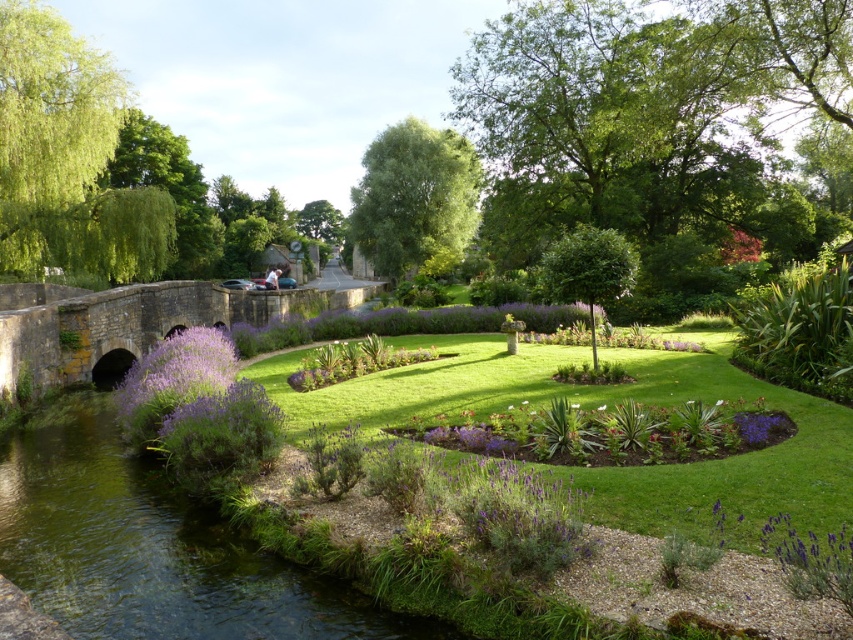
In the scene shown: Who is positioned more to the left, stone bridge at left or purple matte flower at lower right?

From the viewer's perspective, stone bridge at left appears more on the left side.

Can you confirm if stone bridge at left is positioned to the left of purple matte flower at lower right?

Yes, stone bridge at left is to the left of purple matte flower at lower right.

Is point (165, 333) in front of point (764, 440)?

No.

You are a GUI agent. You are given a task and a screenshot of the screen. Output one action in this format:
    pyautogui.click(x=<x>, y=<y>)
    Task: Click on the stone bridge at left
    This screenshot has width=853, height=640.
    Given the screenshot: What is the action you would take?
    pyautogui.click(x=136, y=323)

Is green grassy stream at lower left thinner than purple fluffy bush at left?

Incorrect, green grassy stream at lower left's width is not less than purple fluffy bush at left's.

Does point (77, 390) come behind point (218, 349)?

Yes, it is behind point (218, 349).

Where is `green grassy stream at lower left`? green grassy stream at lower left is located at coordinates (152, 547).

Is purple fluffy bush at left further to camera compared to purple matte flower at lower right?

Yes, it is.

Which of these two, purple fluffy bush at left or purple matte flower at lower right, stands shorter?

Standing shorter between the two is purple matte flower at lower right.

Who is more distant from viewer, (233,349) or (746,429)?

Point (233,349)

Find the location of a particular element. purple fluffy bush at left is located at coordinates (173, 380).